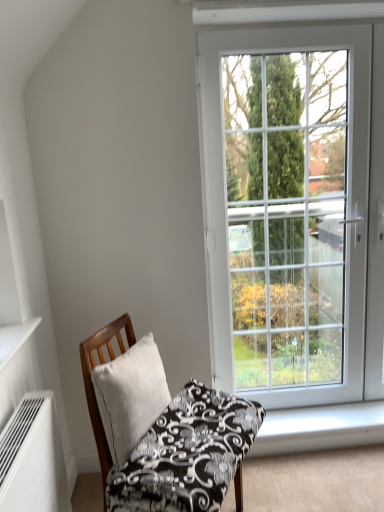
Question: Relative to white linen pillow at center, is white matte air conditioner at lower left in front or behind?

Choices:
 (A) behind
 (B) front

Answer: (B)

Question: From the image's perspective, is white matte air conditioner at lower left positioned above or below white linen pillow at center?

Choices:
 (A) above
 (B) below

Answer: (B)

Question: Which is nearer to the white smooth window sill at lower right?

Choices:
 (A) white glass door at upper right
 (B) white matte shelf at upper left
 (C) white matte air conditioner at lower left
 (D) wooden chair with patterned cushion at lower left
 (E) white linen pillow at center

Answer: (A)

Question: Which of these objects is positioned closest to the white linen pillow at center?

Choices:
 (A) white smooth window sill at lower right
 (B) white matte air conditioner at lower left
 (C) white matte shelf at upper left
 (D) wooden chair with patterned cushion at lower left
 (E) white glass door at upper right

Answer: (D)